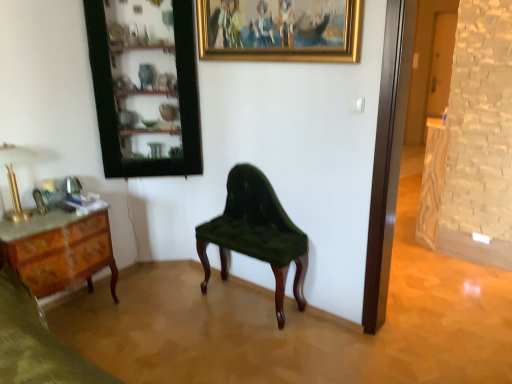
This screenshot has width=512, height=384. Find the location of `free region under velvet green chair at center (from a real-world perspective)`. free region under velvet green chair at center (from a real-world perspective) is located at coordinates (246, 302).